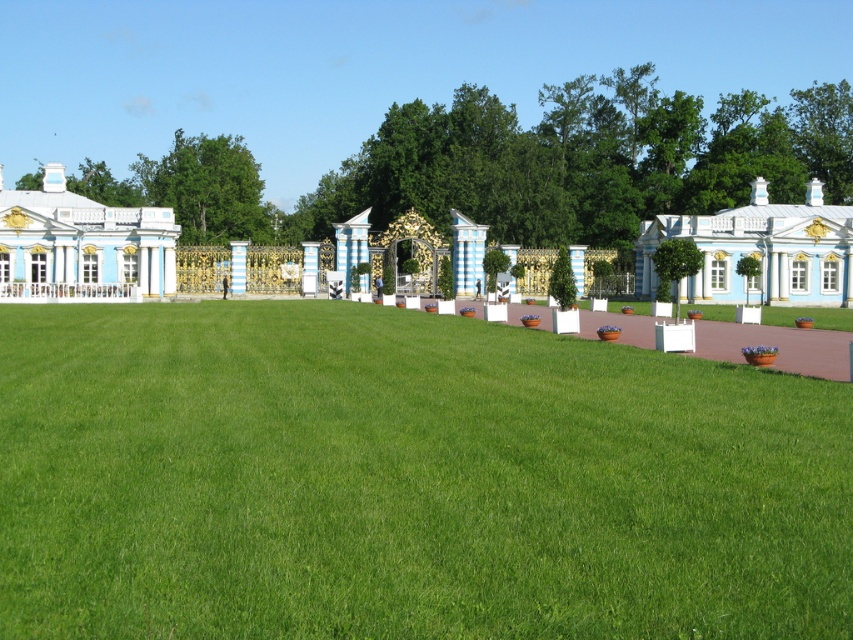
You are planning to install a new garden sprinkler system. The sprinkler needs to cover the green grass at lower center without reaching the white glossy palace at left. Based on the scene description, is this possible?

The green grass at lower center is below the white glossy palace at left, so the sprinkler can be positioned to water the grass without reaching the palace since they are at different vertical levels.